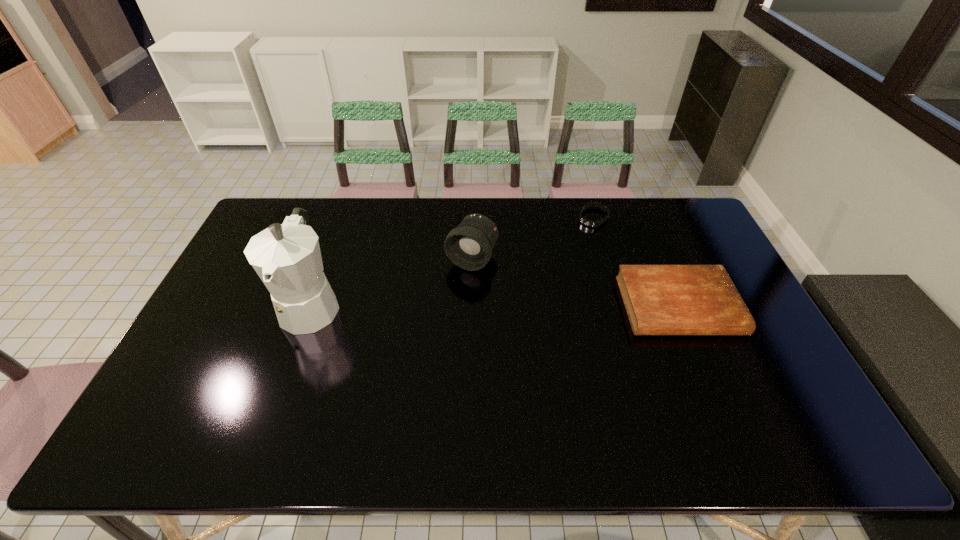
Find the location of a particular element. The image size is (960, 540). vacant space located on the display of the farthest object is located at coordinates (568, 249).

Image resolution: width=960 pixels, height=540 pixels. I want to click on vacant space located on the display of the farthest object, so click(x=550, y=272).

The height and width of the screenshot is (540, 960). I want to click on vacant space located 0.100m at the front element of the telephoto lens, so click(x=448, y=297).

Where is `free location located at the front element of the telephoto lens`? free location located at the front element of the telephoto lens is located at coordinates (448, 297).

Identify the location of free spot located 0.220m at the front element of the telephoto lens. The image size is (960, 540). (430, 326).

You are a GUI agent. You are given a task and a screenshot of the screen. Output one action in this format:
    pyautogui.click(x=<x>, y=<y>)
    Task: Click on the object located in the far edge section of the desktop
    
    Given the screenshot: What is the action you would take?
    pyautogui.click(x=585, y=221)

Where is `object located in the right edge section of the desktop`? The image size is (960, 540). object located in the right edge section of the desktop is located at coordinates (659, 299).

Locate an element on the screen. This screenshot has width=960, height=540. free space at the far edge of the desktop is located at coordinates pos(630,213).

Image resolution: width=960 pixels, height=540 pixels. I want to click on vacant position at the near edge of the desktop, so click(x=725, y=381).

You are a GUI agent. You are given a task and a screenshot of the screen. Output one action in this format:
    pyautogui.click(x=<x>, y=<y>)
    Task: Click on the blank area at the left edge
    
    Given the screenshot: What is the action you would take?
    pyautogui.click(x=197, y=332)